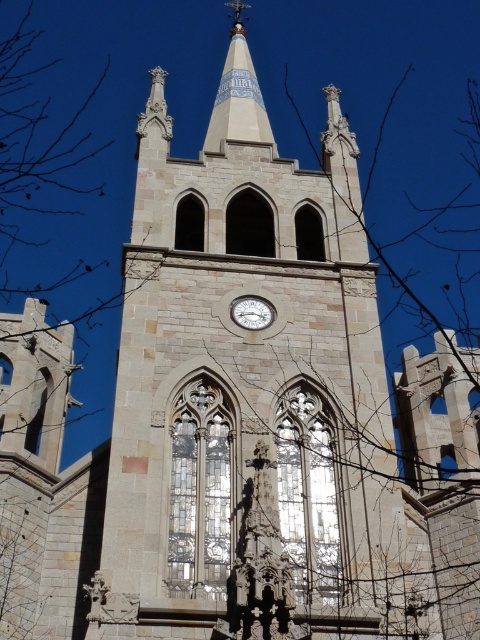
You are standing in front of the Gothic church tower. You notice the white stone spire at upper center and the metallic silver clock at center. Which object is closer to you?

The white stone spire at upper center is closer to you because the metallic silver clock at center is behind it.

You are an architect designing a new addition to the church. You need to ensure that the new structure does not block the view of the metallic silver clock at center from the ground. Given that the white stone spire at upper center is taller, how should you position the new structure relative to these two objects?

The white stone spire at upper center is taller than the metallic silver clock at center. To avoid blocking the view of the metallic silver clock at center, the new structure should be positioned closer to the white stone spire at upper center, as its greater height can obstruct the view of the clock.